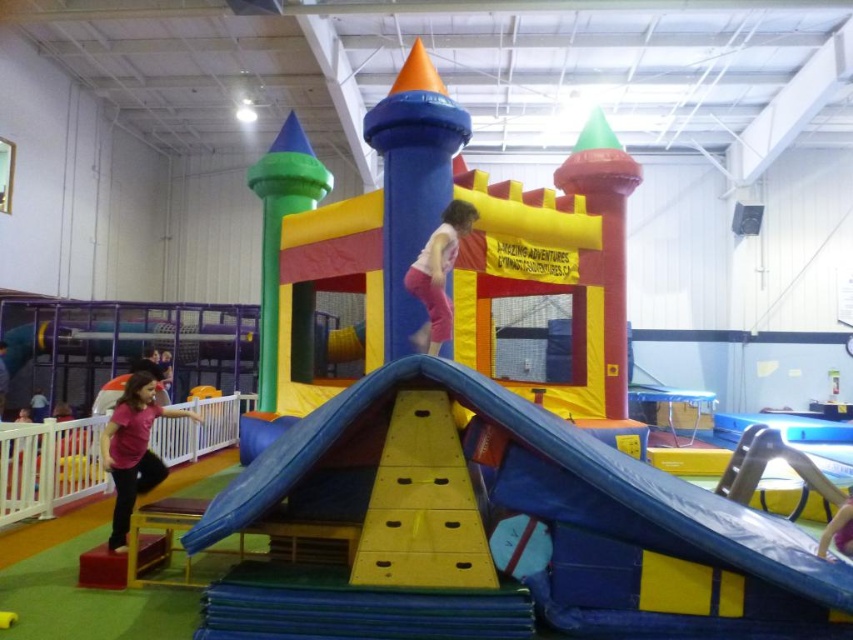
Question: Is pink fabric pants at upper center thinner than pink fabric person at center?

Choices:
 (A) yes
 (B) no

Answer: (B)

Question: Can you confirm if pink fabric person at center is positioned to the left of pink fabric person at lower left?

Choices:
 (A) yes
 (B) no

Answer: (B)

Question: Which point is closer to the camera taking this photo?

Choices:
 (A) (838, 520)
 (B) (3, 376)

Answer: (A)

Question: Can you confirm if pink matte shirt at lower left is smaller than pink fabric person at lower left?

Choices:
 (A) no
 (B) yes

Answer: (B)

Question: Which is farther from the pink matte shirt at lower left?

Choices:
 (A) pink fabric person at lower left
 (B) pink fabric pants at upper center
 (C) pink fabric person at center

Answer: (A)

Question: Which point is farther to the camera?

Choices:
 (A) [463, 225]
 (B) [126, 502]
 (C) [839, 538]

Answer: (A)